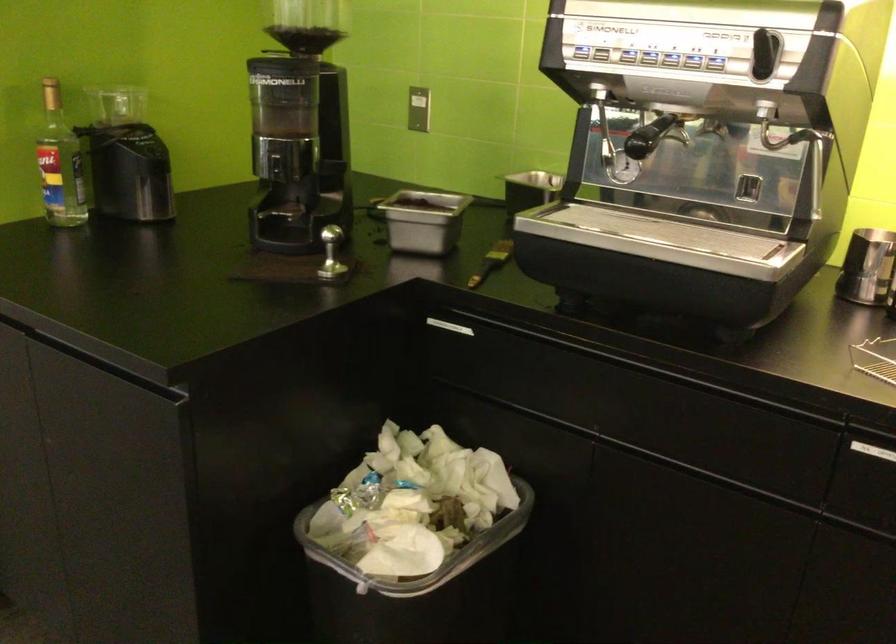
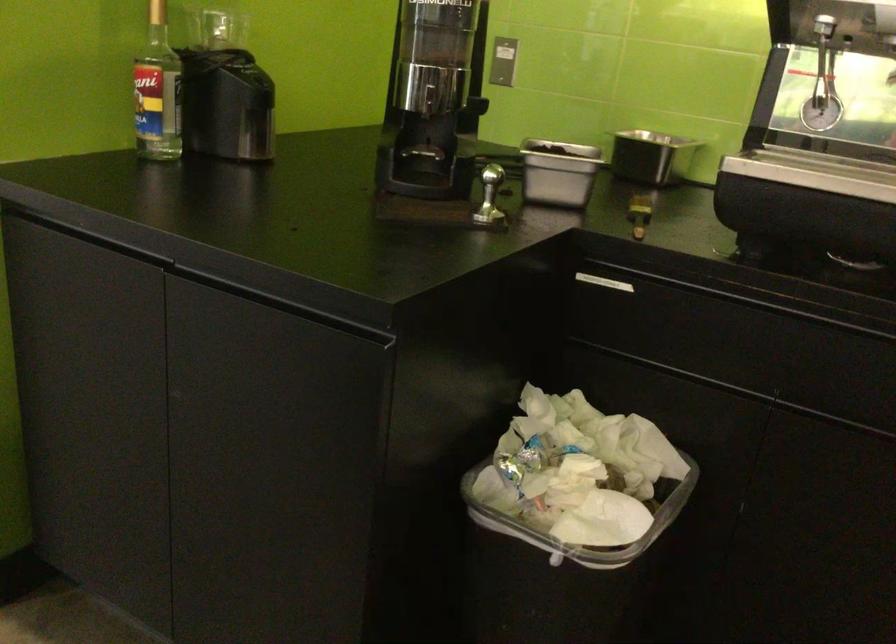
Locate, in the second image, the point that corresponds to point 556,333 in the first image.

(744, 287)